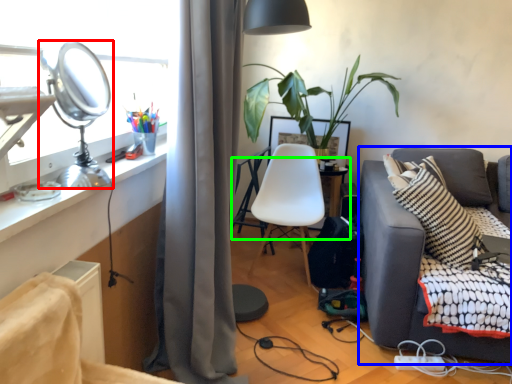
Question: Which object is the closest to the table lamp (highlighted by a red box)? Choose among these: studio couch (highlighted by a blue box) or table (highlighted by a green box).

Choices:
 (A) studio couch
 (B) table

Answer: (A)